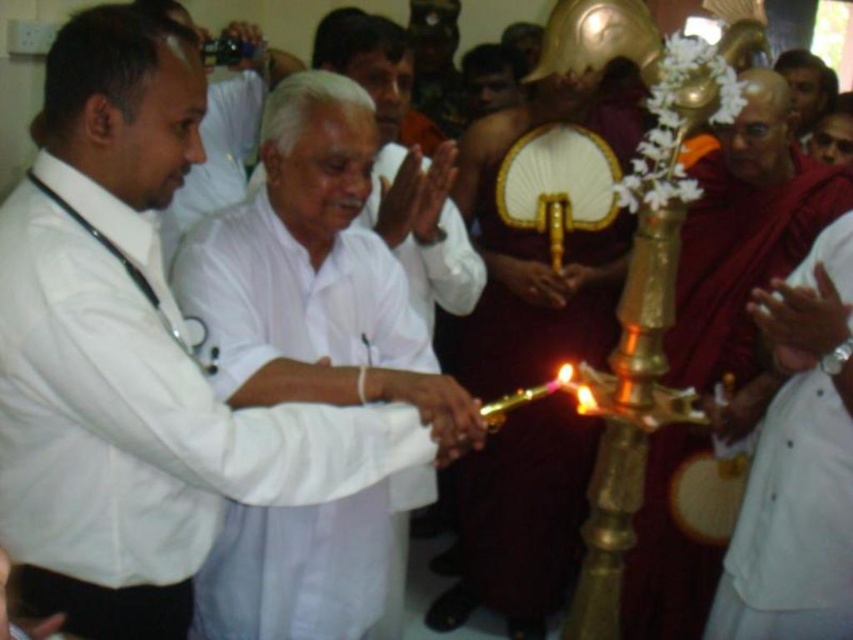
Question: Which point is farther to the camera?

Choices:
 (A) (473, 515)
 (B) (184, 403)
 (C) (254, 330)

Answer: (A)

Question: Which point appears closest to the camera in this image?

Choices:
 (A) click(584, 120)
 (B) click(259, 262)

Answer: (B)

Question: Is white matte shirt at center above shiny gold ceremonial staff at center?

Choices:
 (A) no
 (B) yes

Answer: (A)

Question: Is white matte shirt at center to the left of white cotton robe at center from the viewer's perspective?

Choices:
 (A) no
 (B) yes

Answer: (B)

Question: Observing the image, what is the correct spatial positioning of white matte shirt at center in reference to shiny gold ceremonial staff at center?

Choices:
 (A) above
 (B) below

Answer: (B)

Question: Which is farther from the white cotton robe at center?

Choices:
 (A) white matte shirt at center
 (B) shiny gold ceremonial staff at center

Answer: (B)